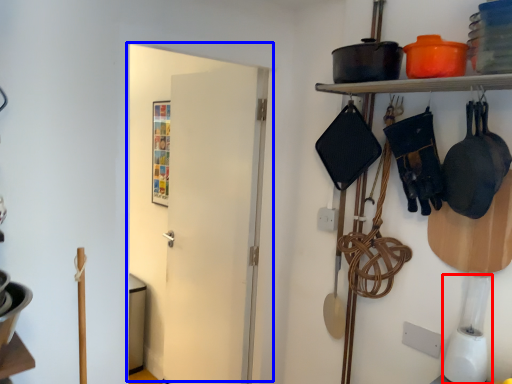
Question: Which point is further to the camera, appliance (highlighted by a red box) or door (highlighted by a blue box)?

Choices:
 (A) appliance
 (B) door

Answer: (B)